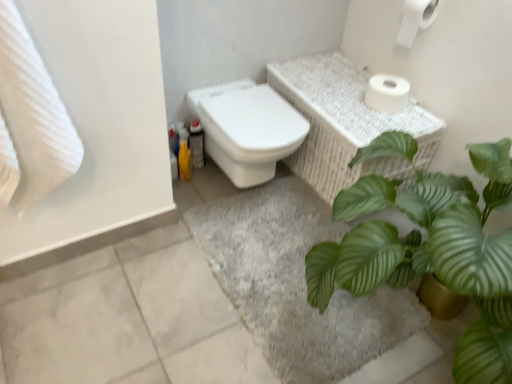
Question: Considering the relative sizes of white textured towel at left and green leafy plant at center in the image provided, is white textured towel at left wider than green leafy plant at center?

Choices:
 (A) no
 (B) yes

Answer: (A)

Question: From a real-world perspective, is white textured towel at left located beneath green leafy plant at center?

Choices:
 (A) yes
 (B) no

Answer: (B)

Question: Is green leafy plant at center completely or partially inside white textured towel at left?

Choices:
 (A) no
 (B) yes

Answer: (A)

Question: Is white textured towel at left with green leafy plant at center?

Choices:
 (A) yes
 (B) no

Answer: (B)

Question: Can you confirm if white textured towel at left is bigger than green leafy plant at center?

Choices:
 (A) no
 (B) yes

Answer: (A)

Question: Is white textured towel at left to the left of green leafy plant at center from the viewer's perspective?

Choices:
 (A) yes
 (B) no

Answer: (A)

Question: Would you say gray soft rug at lower center is a long distance from white matte toilet paper at upper right, which is the 1th toilet paper from top to bottom?

Choices:
 (A) yes
 (B) no

Answer: (A)

Question: Is white matte toilet paper at upper right, the second toilet paper ordered from the bottom, completely or partially inside gray soft rug at lower center?

Choices:
 (A) no
 (B) yes

Answer: (A)

Question: Does gray soft rug at lower center appear on the right side of white matte toilet paper at upper right, the second toilet paper ordered from the bottom?

Choices:
 (A) no
 (B) yes

Answer: (A)

Question: Does gray soft rug at lower center turn towards white matte toilet paper at upper right, which is the 1th toilet paper from top to bottom?

Choices:
 (A) yes
 (B) no

Answer: (B)

Question: Is gray soft rug at lower center bigger than white matte toilet paper at upper right, which is the 1th toilet paper from top to bottom?

Choices:
 (A) yes
 (B) no

Answer: (A)

Question: From the image's perspective, is gray soft rug at lower center above white matte toilet paper at upper right, the second toilet paper ordered from the bottom?

Choices:
 (A) yes
 (B) no

Answer: (B)

Question: From the image's perspective, is gray soft rug at lower center located above white textured towel at left?

Choices:
 (A) no
 (B) yes

Answer: (A)